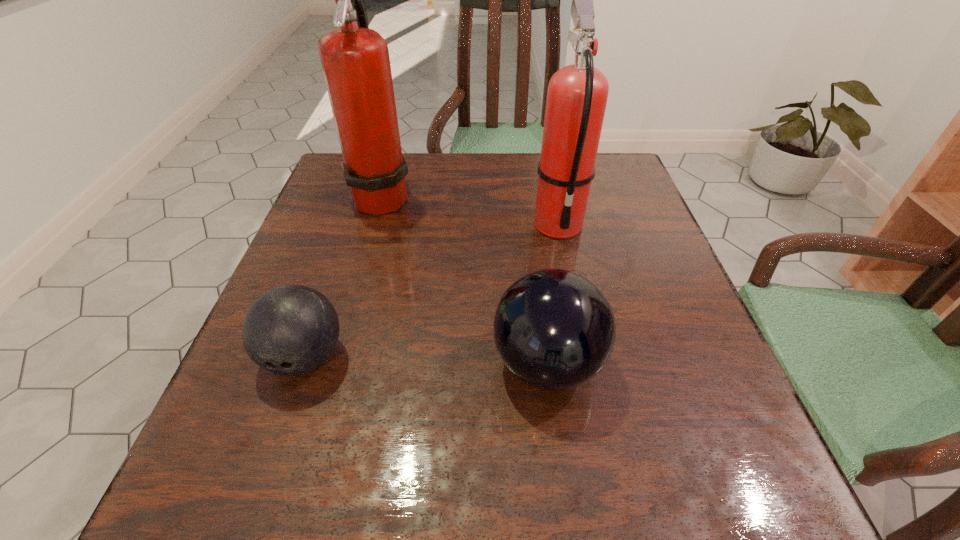
This screenshot has height=540, width=960. What are the coordinates of `vacant space situated on the side of the second shortest object with the finger holes` in the screenshot? It's located at (274, 364).

Find the location of a particular element. vacant space situated on the grip area of the shorter bowling ball is located at coordinates (258, 490).

Identify the location of fire extinguisher that is at the left edge. This screenshot has height=540, width=960. (355, 60).

The width and height of the screenshot is (960, 540). Identify the location of bowling ball present at the left edge. (290, 330).

Identify the location of object that is at the right edge. (577, 94).

Identify the location of object positioned at the far left corner. The width and height of the screenshot is (960, 540). (355, 60).

At what (x,y) coordinates should I click in order to perform the action: click on object located in the far right corner section of the desktop. Please return your answer as a coordinate pair (x, y). The width and height of the screenshot is (960, 540). Looking at the image, I should click on [x=577, y=94].

In the image, there is a desktop. Where is `vacant region at the far edge`? vacant region at the far edge is located at coordinates [459, 184].

Image resolution: width=960 pixels, height=540 pixels. Find the location of `vacant position at the near edge of the desktop`. vacant position at the near edge of the desktop is located at coordinates (434, 469).

In order to click on free point at the left edge in this screenshot , I will do `click(356, 239)`.